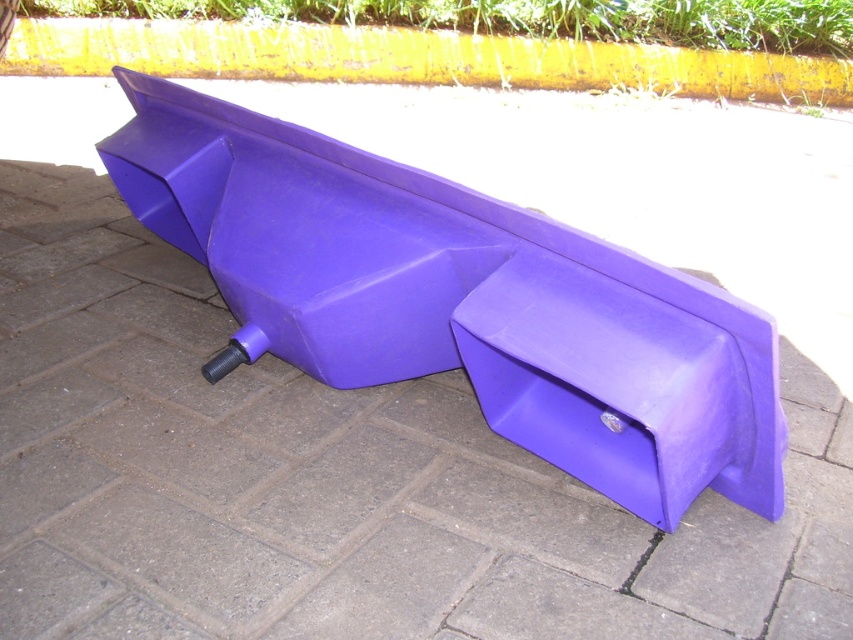
You need to park the matte purple handcart at center in a designated area marked by the yellow painted curb at upper center. Can you park the handcart directly against the curb without moving it past the curb?

The matte purple handcart at center is in front of the yellow painted curb at upper center, meaning it is already positioned in front of the curb. To park it directly against the curb, you would need to move it forward so that it touches the curb. However, since the handcart is currently in front of the curb, you can move it closer to align with the curb for parking.

You are a delivery person trying to maneuver a new package onto the paved surface. The package is 1.2 meters wide. You see the matte purple handcart at center and the yellow painted curb at upper center. Can the package fit between them if placed along the paved surface?

The matte purple handcart at center is narrower than the yellow painted curb at upper center. Since the package is 1.2 meters wide, it might not fit between them unless the distance between the two objects is at least 1.2 meters. However, the provided information only states their widths, not the distance between them. Without knowing the spacing between the matte purple handcart at center and the yellow painted curb at upper center, it is impossible to determine if the package will fit.